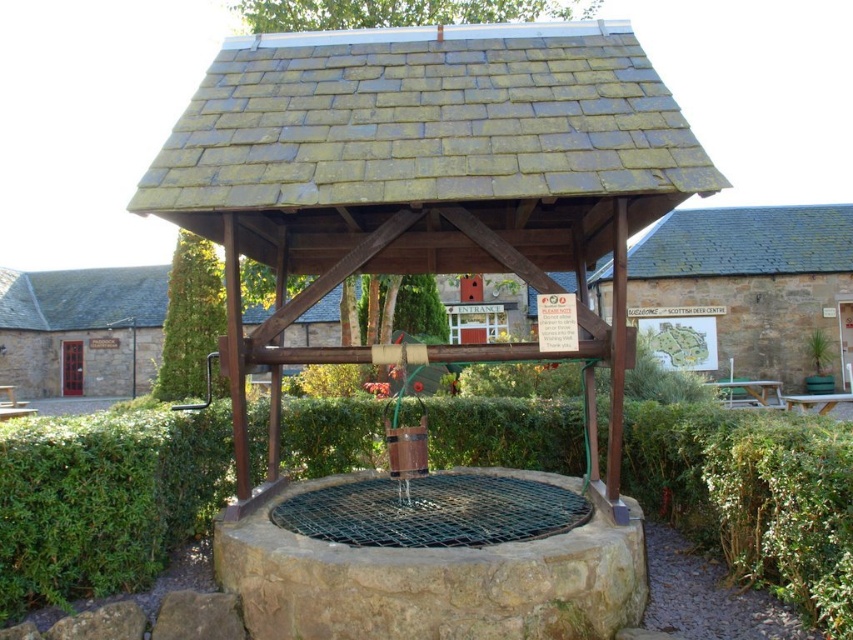
Question: Can you confirm if weathered wood gazebo at center is smaller than green leafy hedge at center?

Choices:
 (A) yes
 (B) no

Answer: (B)

Question: Among these points, which one is nearest to the camera?

Choices:
 (A) (412, 168)
 (B) (223, 326)
 (C) (86, 564)

Answer: (C)

Question: Estimate the real-world distances between objects in this image. Which object is farther from the weathered wood gazebo at center?

Choices:
 (A) green leafy bush at center
 (B) green leafy hedge at center

Answer: (A)

Question: Does weathered wood gazebo at center have a greater width compared to green leafy hedge at center?

Choices:
 (A) no
 (B) yes

Answer: (B)

Question: Considering the real-world distances, which object is farthest from the green leafy bush at center?

Choices:
 (A) weathered wood gazebo at center
 (B) green leafy hedge at center

Answer: (A)

Question: Does weathered wood gazebo at center appear on the left side of green leafy hedge at center?

Choices:
 (A) no
 (B) yes

Answer: (B)